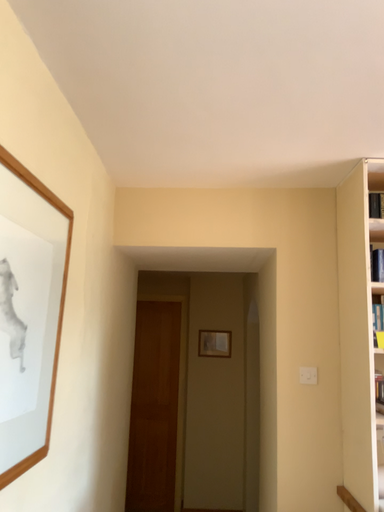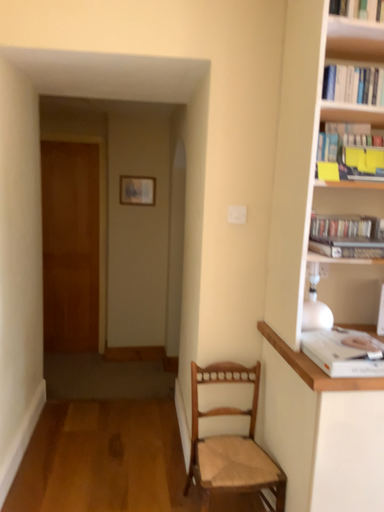
Question: Which way did the camera rotate in the video?

Choices:
 (A) rotated left
 (B) rotated right

Answer: (B)